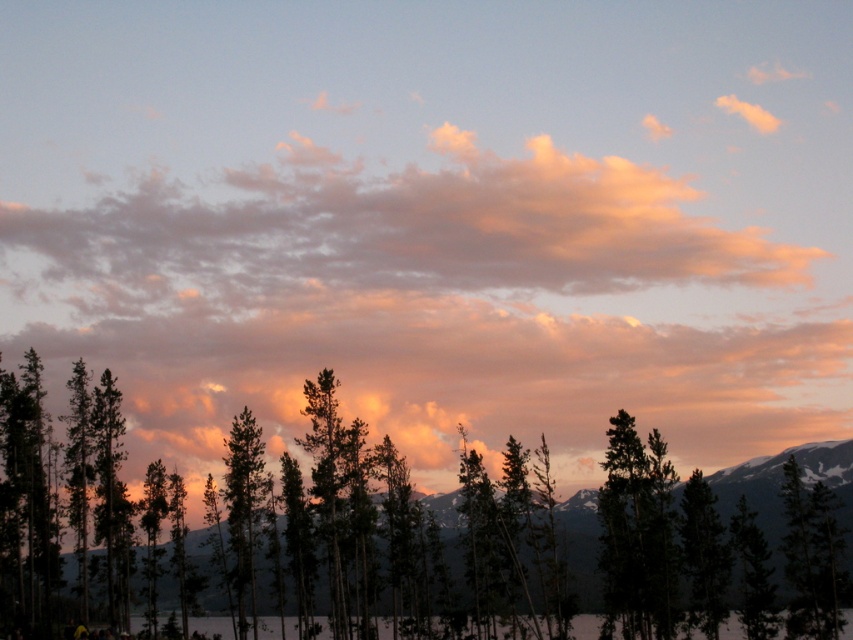
Question: Which point is farther to the camera?

Choices:
 (A) (257, 518)
 (B) (648, 452)

Answer: (A)

Question: Does dark green textured tree at center appear over soft pink cotton clouds at upper center?

Choices:
 (A) yes
 (B) no

Answer: (B)

Question: Is dark green textured tree at center wider than soft pink cotton clouds at upper center?

Choices:
 (A) no
 (B) yes

Answer: (A)

Question: Where is dark green textured tree at center located in relation to green matte tree at center in the image?

Choices:
 (A) below
 (B) above

Answer: (B)

Question: Estimate the real-world distances between objects in this image. Which object is farther from the dark green textured tree at center?

Choices:
 (A) soft pink cotton clouds at upper center
 (B) green matte tree at center
 (C) matte orange cloud at upper center

Answer: (A)

Question: Which object is positioned farthest from the soft pink cotton clouds at upper center?

Choices:
 (A) dark green textured tree at center
 (B) green matte tree at center

Answer: (B)